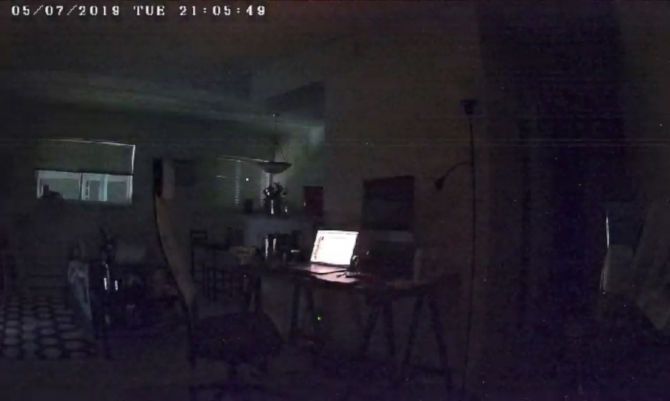
Locate an element on the screen. This screenshot has width=670, height=401. black area of floor is located at coordinates (52, 338), (54, 318), (19, 342).